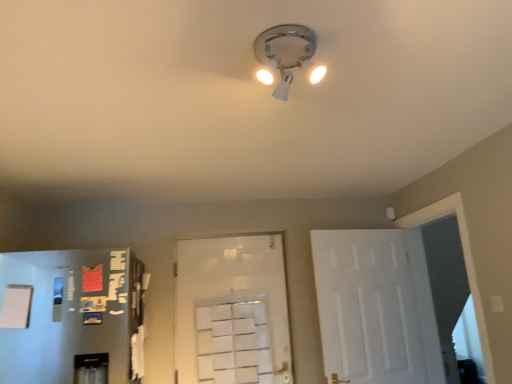
Question: Based on their positions, is matte white light fixture at center located to the left or right of white matte door at center, the second door positioned from the right?

Choices:
 (A) left
 (B) right

Answer: (B)

Question: In terms of size, does matte white light fixture at center appear bigger or smaller than white matte door at center, acting as the first door starting from the left?

Choices:
 (A) small
 (B) big

Answer: (A)

Question: Which of these objects is positioned farthest from the white matte door at center, the second door positioned from the right?

Choices:
 (A) matte white light fixture at center
 (B) white matte door at right, the 2th door viewed from the left

Answer: (A)

Question: Which object is positioned closest to the white matte door at right, which ranks as the 1th door in right-to-left order?

Choices:
 (A) matte white light fixture at center
 (B) white matte door at center, the second door positioned from the right

Answer: (B)